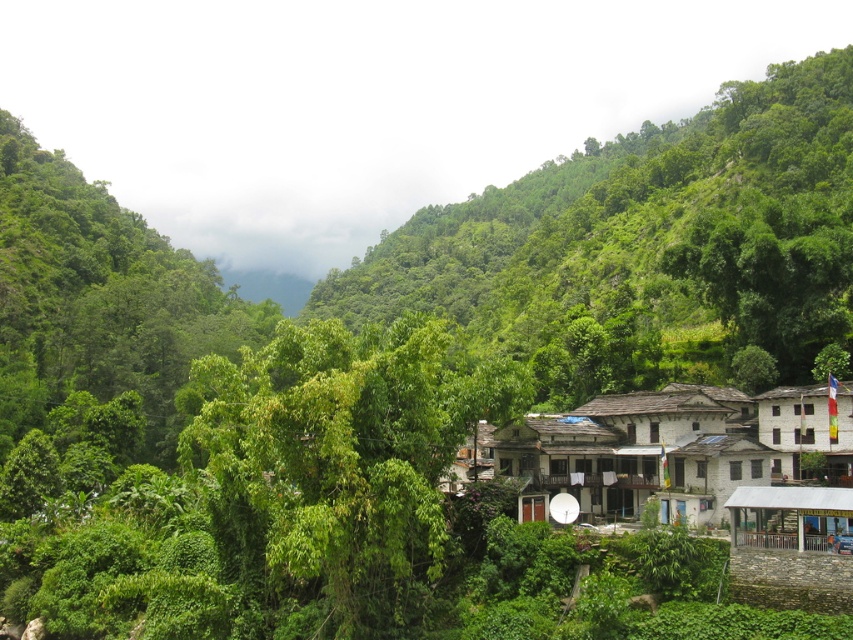
Question: Among these points, which one is farthest from the camera?

Choices:
 (A) (706, 145)
 (B) (747, 541)
 (C) (698, 387)

Answer: (A)

Question: Is white stucco building at center-right bigger than white corrugated metal hut at lower right?

Choices:
 (A) no
 (B) yes

Answer: (B)

Question: Considering the relative positions of green leafy tree at center and white corrugated metal hut at lower right in the image provided, where is green leafy tree at center located with respect to white corrugated metal hut at lower right?

Choices:
 (A) below
 (B) above

Answer: (B)

Question: Does white stucco building at center-right have a greater width compared to white corrugated metal hut at lower right?

Choices:
 (A) no
 (B) yes

Answer: (B)

Question: Which point appears farthest from the camera in this image?

Choices:
 (A) (624, 291)
 (B) (764, 522)

Answer: (A)

Question: Which point is closer to the camera?

Choices:
 (A) (x=479, y=316)
 (B) (x=694, y=435)
 (C) (x=795, y=522)

Answer: (C)